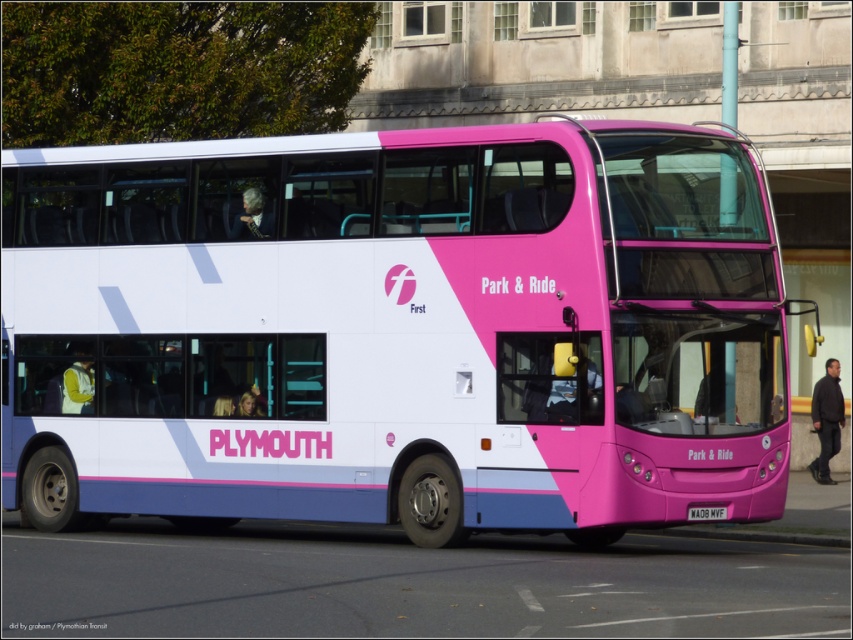
Question: Can you confirm if pink glossy bus at center is bigger than white plastic license plate at lower center?

Choices:
 (A) yes
 (B) no

Answer: (A)

Question: Can you confirm if pink glossy bus at center is wider than white plastic license plate at lower center?

Choices:
 (A) yes
 (B) no

Answer: (A)

Question: Among these points, which one is nearest to the camera?

Choices:
 (A) (708, 513)
 (B) (10, 419)

Answer: (A)

Question: Which point is farther to the camera?

Choices:
 (A) (735, 211)
 (B) (724, 508)

Answer: (A)

Question: Does pink glossy bus at center appear over white plastic license plate at lower center?

Choices:
 (A) no
 (B) yes

Answer: (B)